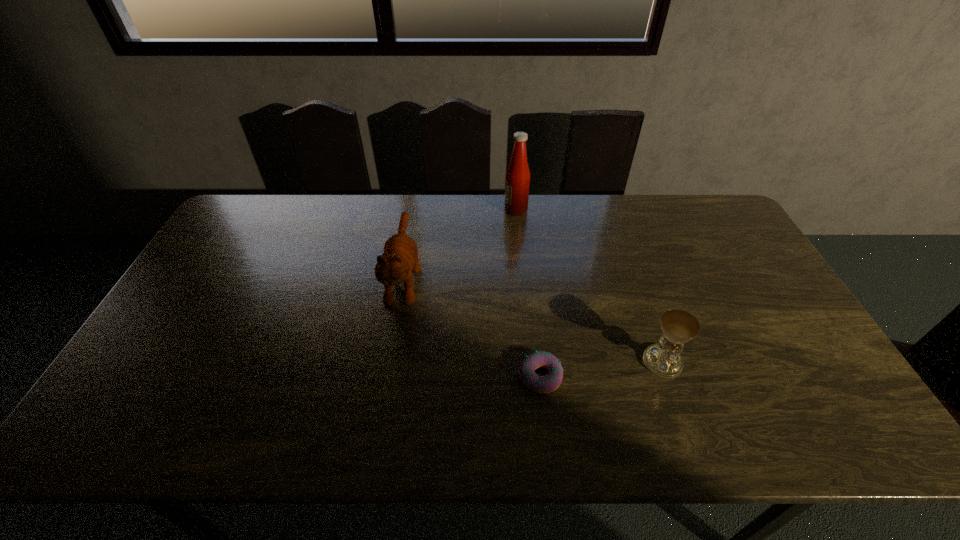
Identify the location of vacant space situated 0.120m on the face of the cat. This screenshot has width=960, height=540. (391, 354).

This screenshot has width=960, height=540. I want to click on vacant area situated 0.110m on the front of the second shortest object, so 683,420.

The height and width of the screenshot is (540, 960). What are the coordinates of `vacant space located on the right of the shortest object` in the screenshot? It's located at (659, 376).

Find the location of a particular element. object that is at the far edge is located at coordinates (517, 182).

Locate an element on the screen. blank space at the far edge of the desktop is located at coordinates (439, 198).

Find the location of a particular element. vacant position at the near edge of the desktop is located at coordinates (432, 426).

Find the location of `free space at the left edge of the desktop`. free space at the left edge of the desktop is located at coordinates (222, 326).

I want to click on free region at the right edge of the desktop, so click(x=742, y=310).

In order to click on vacant space at the near right corner in this screenshot , I will do `click(825, 422)`.

This screenshot has height=540, width=960. Find the location of `unoccupied position between the doughnut and the rightmost object`. unoccupied position between the doughnut and the rightmost object is located at coordinates (602, 369).